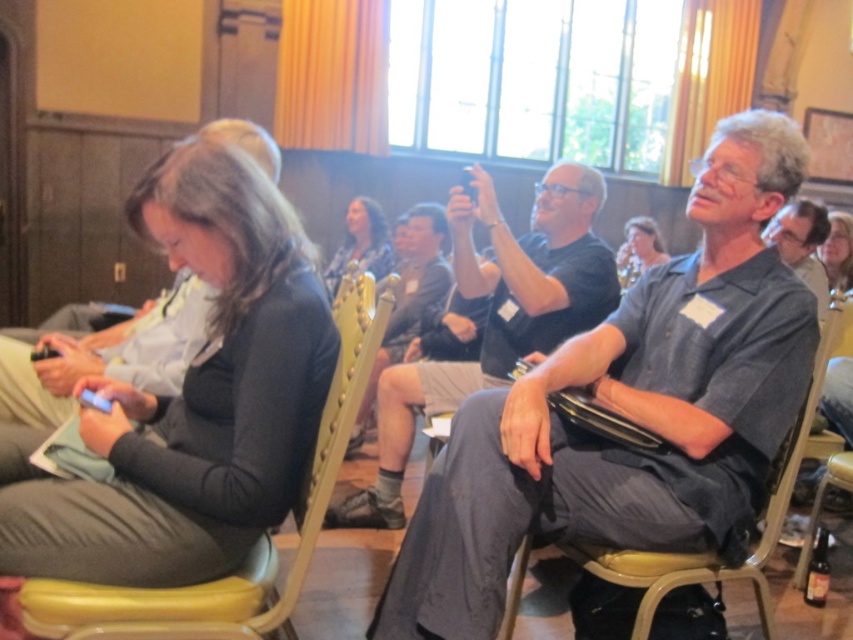
Can you confirm if dark gray shirt at center is wider than yellow vinyl chair at lower left?

Yes.

Who is higher up, dark gray shirt at center or yellow vinyl chair at lower left?

dark gray shirt at center is above.

Who is more forward, (788, 372) or (183, 627)?

Point (183, 627) is more forward.

I want to click on dark gray shirt at center, so click(630, 410).

Consider the image. Is yellow vinyl chair at lower left positioned behind gray fabric shirt at upper right?

No, yellow vinyl chair at lower left is in front of gray fabric shirt at upper right.

Does yellow vinyl chair at lower left appear on the left side of gray fabric shirt at upper right?

Correct, you'll find yellow vinyl chair at lower left to the left of gray fabric shirt at upper right.

Find the location of `yellow vinyl chair at lower left`. yellow vinyl chair at lower left is located at coordinates (253, 550).

Who is positioned more to the left, yellow vinyl chair at lower left or matte black hair at upper center?

From the viewer's perspective, yellow vinyl chair at lower left appears more on the left side.

Who is lower down, yellow vinyl chair at lower left or matte black hair at upper center?

yellow vinyl chair at lower left is lower down.

Does point (300, 547) lie behind point (619, 284)?

No, (300, 547) is in front of (619, 284).

The height and width of the screenshot is (640, 853). I want to click on yellow vinyl chair at lower left, so click(253, 550).